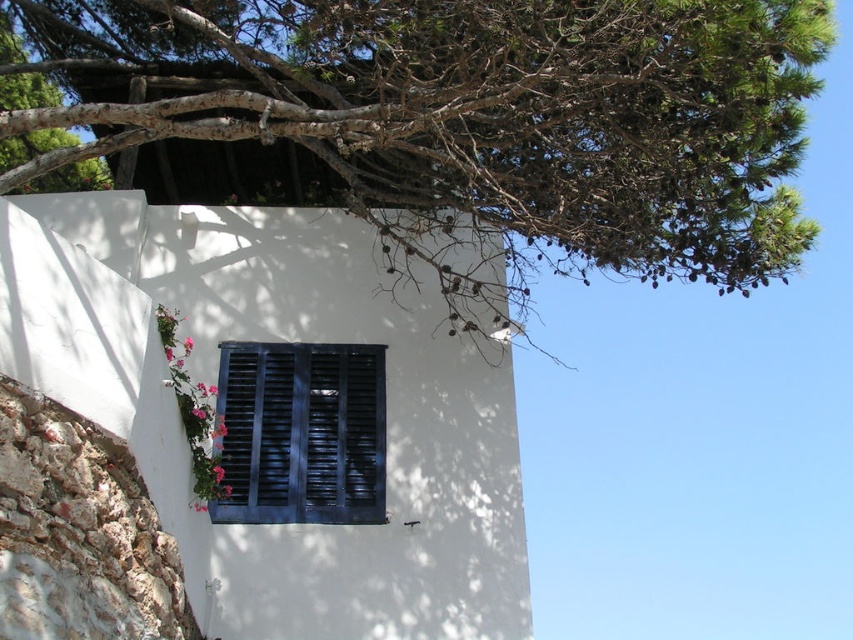
Question: Can you confirm if green leafy tree at upper center is wider than dark wood shutters at center?

Choices:
 (A) no
 (B) yes

Answer: (B)

Question: Does green leafy tree at upper center have a smaller size compared to dark wood shutters at center?

Choices:
 (A) yes
 (B) no

Answer: (B)

Question: Which object appears closest to the camera in this image?

Choices:
 (A) green leafy tree at upper center
 (B) dark wood shutters at center

Answer: (A)

Question: Is green leafy tree at upper center positioned before dark wood shutters at center?

Choices:
 (A) yes
 (B) no

Answer: (A)

Question: Which point is farther to the camera?

Choices:
 (A) (379, 346)
 (B) (671, 86)

Answer: (A)